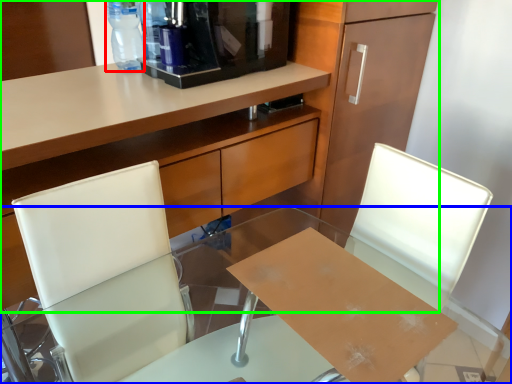
Question: Estimate the real-world distances between objects in this image. Which object is farther from bottle (highlighted by a red box), desk (highlighted by a blue box) or cabinetry (highlighted by a green box)?

Choices:
 (A) desk
 (B) cabinetry

Answer: (A)